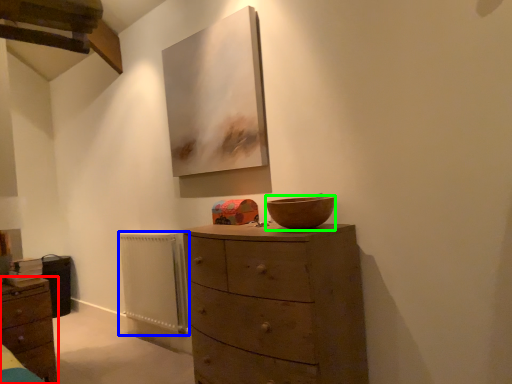
Question: Which is nearer to the chest of drawers (highlighted by a red box)? radiator (highlighted by a blue box) or bowl (highlighted by a green box).

Choices:
 (A) radiator
 (B) bowl

Answer: (A)